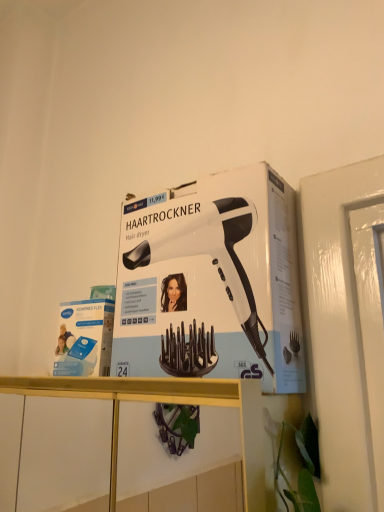
Describe the element at coordinates (213, 256) in the screenshot. The height and width of the screenshot is (512, 384). I see `white matte hair dryer at upper center` at that location.

At what (x,y) coordinates should I click in order to perform the action: click on white matte hair dryer at upper center. Please return your answer as a coordinate pair (x, y). Looking at the image, I should click on (213, 256).

The height and width of the screenshot is (512, 384). Identify the location of white glossy shelf at upper center. (161, 400).

The height and width of the screenshot is (512, 384). What do you see at coordinates (161, 400) in the screenshot? I see `white glossy shelf at upper center` at bounding box center [161, 400].

Find the location of `white matte hair dryer at upper center`. white matte hair dryer at upper center is located at coordinates (213, 256).

Considering the relative positions of white glossy shelf at upper center and white matte hair dryer at upper center in the image provided, is white glossy shelf at upper center to the left or to the right of white matte hair dryer at upper center?

white glossy shelf at upper center is to the left of white matte hair dryer at upper center.

Is white glossy shelf at upper center in front of white matte hair dryer at upper center?

That is True.

Considering the points (136, 400) and (183, 341), which point is in front, point (136, 400) or point (183, 341)?

The point (183, 341) is closer.

Consider the image. From the image's perspective, which object appears higher, white glossy shelf at upper center or white matte hair dryer at upper center?

white matte hair dryer at upper center.

From a real-world perspective, is white glossy shelf at upper center on white matte hair dryer at upper center?

No, from a real-world perspective, white glossy shelf at upper center is not above white matte hair dryer at upper center.

Considering the sizes of white glossy shelf at upper center and white matte hair dryer at upper center in the image, is white glossy shelf at upper center wider or thinner than white matte hair dryer at upper center?

In the image, white glossy shelf at upper center appears to be wider than white matte hair dryer at upper center.

Who is shorter, white glossy shelf at upper center or white matte hair dryer at upper center?

white glossy shelf at upper center.

Between white glossy shelf at upper center and white matte hair dryer at upper center, which one has larger size?

white glossy shelf at upper center is bigger.

Is white glossy shelf at upper center not inside white matte hair dryer at upper center?

That's correct, white glossy shelf at upper center is outside of white matte hair dryer at upper center.

Are white glossy shelf at upper center and white matte hair dryer at upper center beside each other?

No, white glossy shelf at upper center is not with white matte hair dryer at upper center.

Could you tell me if white glossy shelf at upper center is turned towards white matte hair dryer at upper center?

No, white glossy shelf at upper center is not aimed at white matte hair dryer at upper center.

Can you tell me how much white glossy shelf at upper center and white matte hair dryer at upper center differ in facing direction?

The facing directions of white glossy shelf at upper center and white matte hair dryer at upper center are 5.32 degrees apart.

Measure the distance from white glossy shelf at upper center to white matte hair dryer at upper center.

A distance of 5.13 inches exists between white glossy shelf at upper center and white matte hair dryer at upper center.

This screenshot has height=512, width=384. In order to click on furniture that is under the white matte hair dryer at upper center (from a real-world perspective) in this screenshot , I will do `click(161, 400)`.

Is white matte hair dryer at upper center at the left side of white glossy shelf at upper center?

No.

Which object is further away from the camera taking this photo, white matte hair dryer at upper center or white glossy shelf at upper center?

white matte hair dryer at upper center.

Which is behind, point (161, 238) or point (158, 396)?

The point (161, 238) is behind.

From the image's perspective, is white matte hair dryer at upper center under white glossy shelf at upper center?

Incorrect, from the image's perspective, white matte hair dryer at upper center is higher than white glossy shelf at upper center.

From a real-world perspective, who is located higher, white matte hair dryer at upper center or white glossy shelf at upper center?

white matte hair dryer at upper center, from a real-world perspective.

Considering the relative sizes of white matte hair dryer at upper center and white glossy shelf at upper center in the image provided, is white matte hair dryer at upper center thinner than white glossy shelf at upper center?

Yes.

Can you confirm if white matte hair dryer at upper center is shorter than white glossy shelf at upper center?

In fact, white matte hair dryer at upper center may be taller than white glossy shelf at upper center.

Looking at the image, does white matte hair dryer at upper center seem bigger or smaller compared to white glossy shelf at upper center?

In the image, white matte hair dryer at upper center appears to be smaller than white glossy shelf at upper center.

Is white matte hair dryer at upper center not inside white glossy shelf at upper center?

That's correct, white matte hair dryer at upper center is outside of white glossy shelf at upper center.

Is white matte hair dryer at upper center far away from white glossy shelf at upper center?

No.

Is white matte hair dryer at upper center aimed at white glossy shelf at upper center?

No, white matte hair dryer at upper center is not turned towards white glossy shelf at upper center.

How many degrees apart are the facing directions of white matte hair dryer at upper center and white glossy shelf at upper center?

white matte hair dryer at upper center and white glossy shelf at upper center are facing 5.32 degrees away from each other.

How far apart are white matte hair dryer at upper center and white glossy shelf at upper center?

white matte hair dryer at upper center and white glossy shelf at upper center are 5.13 inches apart.

Locate an element on the screen. The width and height of the screenshot is (384, 512). furniture on the left of the white matte hair dryer at upper center is located at coordinates (161, 400).

Where is `furniture that is below the white matte hair dryer at upper center (from the image's perspective)`? The height and width of the screenshot is (512, 384). furniture that is below the white matte hair dryer at upper center (from the image's perspective) is located at coordinates (161, 400).

The width and height of the screenshot is (384, 512). Find the location of `hair drier on the right of white glossy shelf at upper center`. hair drier on the right of white glossy shelf at upper center is located at coordinates (213, 256).